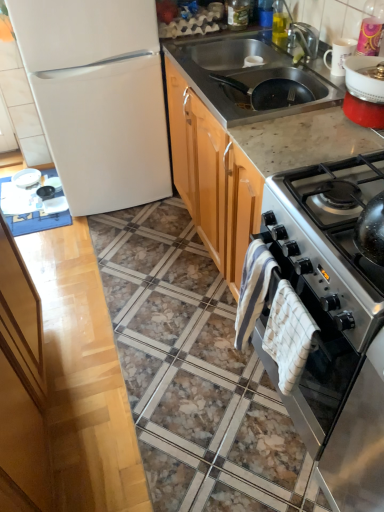
What do you see at coordinates (288, 335) in the screenshot? I see `white checkered towel at right, arranged as the 2th blanket when viewed from the left` at bounding box center [288, 335].

Measure the distance between white glossy plate at upper left, which ranks as the first appliance in left-to-right order, and camera.

The depth of white glossy plate at upper left, which ranks as the first appliance in left-to-right order, is 2.58 meters.

The height and width of the screenshot is (512, 384). What do you see at coordinates (340, 207) in the screenshot?
I see `satin silver gas stove at right` at bounding box center [340, 207].

Measure the distance between point (250, 319) and camera.

The depth of point (250, 319) is 4.40 feet.

In order to face black matte frying pan at upper right, should I rotate leftwards or rightwards?

To align with it, rotate right about 9.448°.

This screenshot has width=384, height=512. I want to click on white checkered towel at right, arranged as the 2th blanket when viewed from the left, so click(x=288, y=335).

Is point (201, 205) behind point (110, 32)?

Yes, point (201, 205) is farther from viewer.

Does marble/granite countertop at center have a smaller size compared to white matte refrigerator at left?

Yes.

Locate an element on the screen. refrigerator on the left of marble/granite countertop at center is located at coordinates (98, 97).

Considering the relative sizes of white glossy plate at upper left, which is the 2th appliance from top to bottom, and satin silver gas stove at right in the image provided, is white glossy plate at upper left, which is the 2th appliance from top to bottom, smaller than satin silver gas stove at right?

Yes.

Does white glossy plate at upper left, the first appliance in the back-to-front sequence, have a greater width compared to satin silver gas stove at right?

No.

Is white glossy plate at upper left, which ranks as the first appliance in left-to-right order, turned away from satin silver gas stove at right?

white glossy plate at upper left, which ranks as the first appliance in left-to-right order, is not turned away from satin silver gas stove at right.

From the image's perspective, is white glossy plate at upper left, the first appliance positioned from the bottom, above or below satin silver gas stove at right?

white glossy plate at upper left, the first appliance positioned from the bottom, is situated higher than satin silver gas stove at right in the image.

Based on the photo, from a real-world perspective, is white ceramic mug at upper right, placed as the 2th appliance when sorted from back to front, on top of white glossy plate at upper left, which ranks as the first appliance in left-to-right order?

Indeed, from a real-world perspective, white ceramic mug at upper right, placed as the 2th appliance when sorted from back to front, stands above white glossy plate at upper left, which ranks as the first appliance in left-to-right order.

Is white ceramic mug at upper right, the first appliance viewed from the front, beside white glossy plate at upper left, which is counted as the 2th appliance, starting from the right?

No, white ceramic mug at upper right, the first appliance viewed from the front, is not beside white glossy plate at upper left, which is counted as the 2th appliance, starting from the right.

Between white ceramic mug at upper right, the 1th appliance positioned from the right, and white glossy plate at upper left, the 2th appliance positioned from the front, which one appears on the left side from the viewer's perspective?

From the viewer's perspective, white glossy plate at upper left, the 2th appliance positioned from the front, appears more on the left side.

Do you think stainless steel sink at upper right is within white matte refrigerator at left, or outside of it?

stainless steel sink at upper right is outside white matte refrigerator at left.

From the image's perspective, is stainless steel sink at upper right above white matte refrigerator at left?

Incorrect, from the image's perspective, stainless steel sink at upper right is lower than white matte refrigerator at left.

Is stainless steel sink at upper right not near white matte refrigerator at left?

Actually, stainless steel sink at upper right and white matte refrigerator at left are a little close together.

In the scene shown: Between white checkered towel at right, arranged as the 2th blanket when viewed from the left, and striped cotton towel at lower right, which is counted as the 1th blanket, starting from the left, which one is positioned behind?

striped cotton towel at lower right, which is counted as the 1th blanket, starting from the left, is more distant.

You are a GUI agent. You are given a task and a screenshot of the screen. Output one action in this format:
    pyautogui.click(x=<x>, y=<y>)
    Task: Click on the blanket in front of the striped cotton towel at lower right, positioned as the second blanket in right-to-left order
    This screenshot has height=512, width=384.
    Given the screenshot: What is the action you would take?
    point(288,335)

Are white checkered towel at right, arranged as the 2th blanket when viewed from the left, and striped cotton towel at lower right, which is counted as the 1th blanket, starting from the left, far apart?

No, white checkered towel at right, arranged as the 2th blanket when viewed from the left, is not far away from striped cotton towel at lower right, which is counted as the 1th blanket, starting from the left.

Which object is positioned more to the left, white matte refrigerator at left or satin silver gas stove at right?

From the viewer's perspective, white matte refrigerator at left appears more on the left side.

Is white matte refrigerator at left in front of or behind satin silver gas stove at right in the image?

white matte refrigerator at left is positioned farther from the viewer than satin silver gas stove at right.

Is white matte refrigerator at left far from satin silver gas stove at right?

Yes, white matte refrigerator at left is far from satin silver gas stove at right.

Is white matte refrigerator at left taller than satin silver gas stove at right?

Indeed, white matte refrigerator at left has a greater height compared to satin silver gas stove at right.

Is marble/granite countertop at center behind white glossy plate at upper left, the first appliance in the back-to-front sequence?

No, it is not.

Considering the relative sizes of marble/granite countertop at center and white glossy plate at upper left, the first appliance positioned from the bottom, in the image provided, is marble/granite countertop at center thinner than white glossy plate at upper left, the first appliance positioned from the bottom,?

Incorrect, the width of marble/granite countertop at center is not less than that of white glossy plate at upper left, the first appliance positioned from the bottom.

Where is `countertop below the white glossy plate at upper left, which is counted as the 2th appliance, starting from the right (from a real-world perspective)`? This screenshot has height=512, width=384. countertop below the white glossy plate at upper left, which is counted as the 2th appliance, starting from the right (from a real-world perspective) is located at coordinates (288, 234).

Considering the points (306, 136) and (30, 182), which point is behind, point (306, 136) or point (30, 182)?

The point (30, 182) is behind.

Identify the location of refrigerator to the left of marble/granite countertop at center. (98, 97).

Find the location of a particular element. The height and width of the screenshot is (512, 384). the 1st appliance above the satin silver gas stove at right (from the image's perspective) is located at coordinates (26, 178).

From the image, which object appears to be nearer to black matte frying pan at upper right, white ceramic mug at upper right, the 2th appliance positioned from the bottom, or white matte refrigerator at left?

Based on the image, white ceramic mug at upper right, the 2th appliance positioned from the bottom, appears to be nearer to black matte frying pan at upper right.

In the scene shown: Estimate the real-world distances between objects in this image. Which object is closer to marble/granite countertop at center, striped cotton towel at lower right, positioned as the second blanket in right-to-left order, or white checkered towel at right, the first blanket in the right-to-left sequence?

Among the two, white checkered towel at right, the first blanket in the right-to-left sequence, is located nearer to marble/granite countertop at center.

Considering their positions, is white matte refrigerator at left positioned closer to satin silver oven at right than stainless steel sink at upper right?

stainless steel sink at upper right is closer to satin silver oven at right.

Based on their spatial positions, is striped cotton towel at lower right, positioned as the second blanket in right-to-left order, or stainless steel sink at upper right further from white glossy plate at upper left, which ranks as the first appliance in left-to-right order?

The object further to white glossy plate at upper left, which ranks as the first appliance in left-to-right order, is striped cotton towel at lower right, positioned as the second blanket in right-to-left order.

Estimate the real-world distances between objects in this image. Which object is further from marble/granite countertop at center, white checkered towel at right, arranged as the 2th blanket when viewed from the left, or white glossy plate at upper left, the 2th appliance positioned from the front?

Among the two, white glossy plate at upper left, the 2th appliance positioned from the front, is located further to marble/granite countertop at center.

When comparing their distances from white matte refrigerator at left, does stainless steel sink at upper right or white checkered towel at right, the first blanket in the right-to-left sequence, seem closer?

stainless steel sink at upper right lies closer to white matte refrigerator at left than the other object.

From the image, which object appears to be farther from white matte refrigerator at left, satin silver oven at right or satin silver gas stove at right?

satin silver oven at right is positioned further to the anchor white matte refrigerator at left.

Estimate the real-world distances between objects in this image. Which object is closer to marble/granite countertop at center, stainless steel sink at upper right or satin silver gas stove at right?

stainless steel sink at upper right is closer to marble/granite countertop at center.

Image resolution: width=384 pixels, height=512 pixels. In order to click on sink between marble/granite countertop at center and white glossy plate at upper left, the first appliance positioned from the bottom, along the z-axis in this screenshot , I will do `click(249, 76)`.

Find the location of a particular element. This screenshot has height=512, width=384. sink between white checkered towel at right, the first blanket in the right-to-left sequence, and white glossy plate at upper left, the first appliance positioned from the bottom, in the front-back direction is located at coordinates (249, 76).

Where is `gas stove between white ceramic mug at upper right, the 1th appliance positioned from the right, and striped cotton towel at lower right, which is counted as the 1th blanket, starting from the left, from top to bottom`? gas stove between white ceramic mug at upper right, the 1th appliance positioned from the right, and striped cotton towel at lower right, which is counted as the 1th blanket, starting from the left, from top to bottom is located at coordinates (340, 207).

The image size is (384, 512). In order to click on refrigerator located between marble/granite countertop at center and white glossy plate at upper left, which ranks as the first appliance in left-to-right order, in the depth direction in this screenshot , I will do `click(98, 97)`.